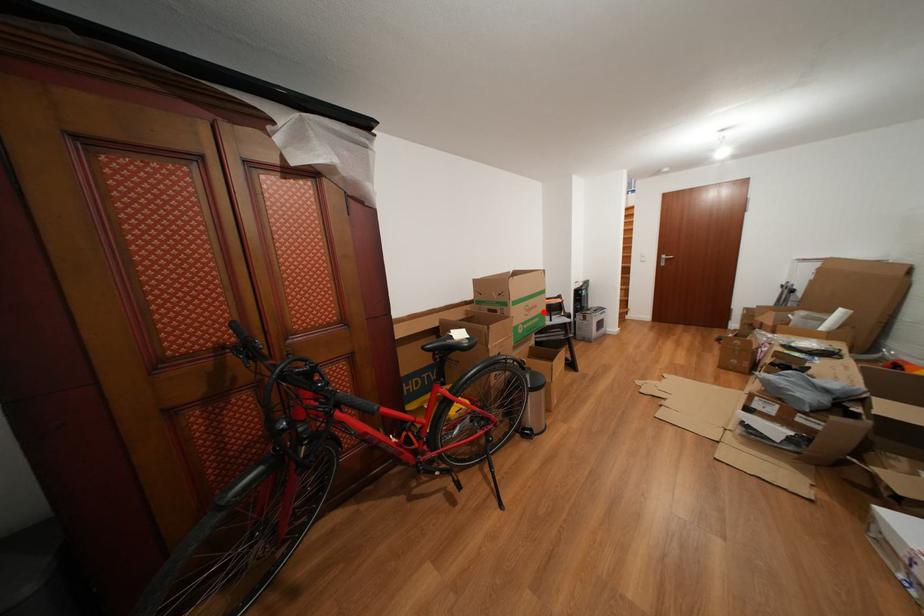
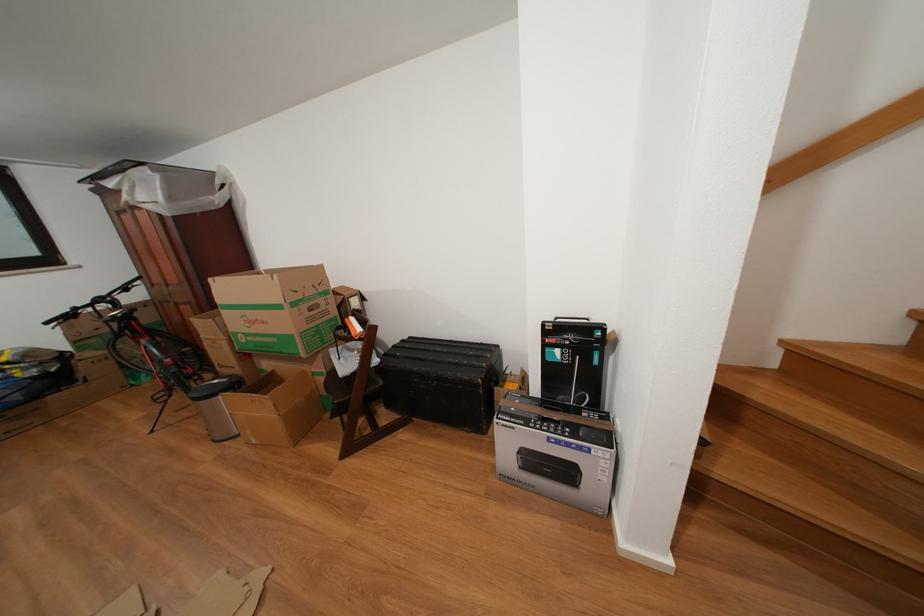
Find the pixel in the second image that matches the highlighted location in the first image.

(272, 328)